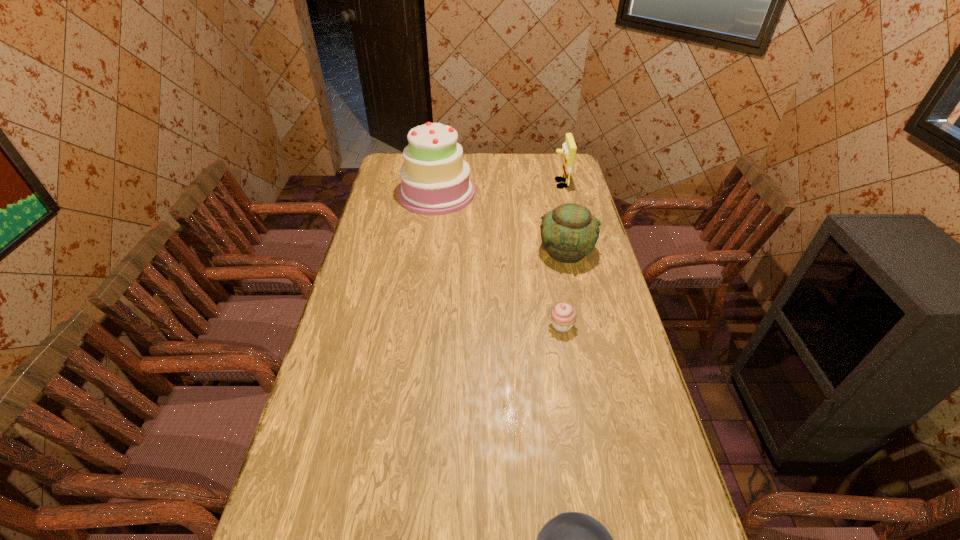
This screenshot has width=960, height=540. I want to click on object present at the far right corner, so click(569, 148).

At what (x,y) coordinates should I click in order to perform the action: click on vacant space at the left edge. Please return your answer as a coordinate pair (x, y). This screenshot has height=540, width=960. Looking at the image, I should click on (398, 198).

Locate an element on the screen. The image size is (960, 540). vacant space at the right edge is located at coordinates (612, 478).

In the image, there is a desktop. At what (x,y) coordinates should I click in order to perform the action: click on blank space at the far left corner. Please return your answer as a coordinate pair (x, y). The image size is (960, 540). Looking at the image, I should click on (396, 163).

This screenshot has height=540, width=960. In the image, there is a desktop. Find the location of `vacant space at the far right corner`. vacant space at the far right corner is located at coordinates (542, 163).

Where is `free space between the leftmost object and the sponge`? free space between the leftmost object and the sponge is located at coordinates (498, 188).

Find the location of a particular element. blank region between the pottery and the cupcake is located at coordinates (564, 288).

Find the location of a particular element. This screenshot has width=960, height=540. free space that is in between the leftmost object and the cupcake is located at coordinates (499, 259).

Where is `object that is the second nearest to the cupcake`? The image size is (960, 540). object that is the second nearest to the cupcake is located at coordinates (572, 539).

Where is `the third closest object to the tallest object`? The width and height of the screenshot is (960, 540). the third closest object to the tallest object is located at coordinates (563, 316).